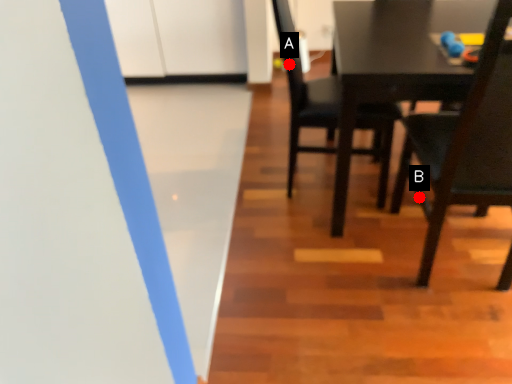
Question: Two points are circled on the image, labeled by A and B beside each circle. Which point is closer to the camera taking this photo?

Choices:
 (A) A is closer
 (B) B is closer

Answer: (B)